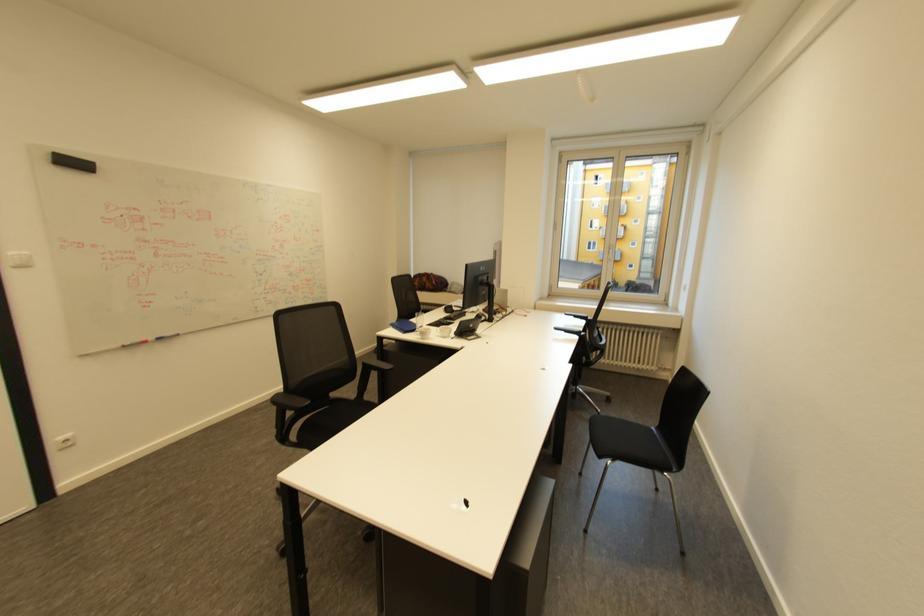
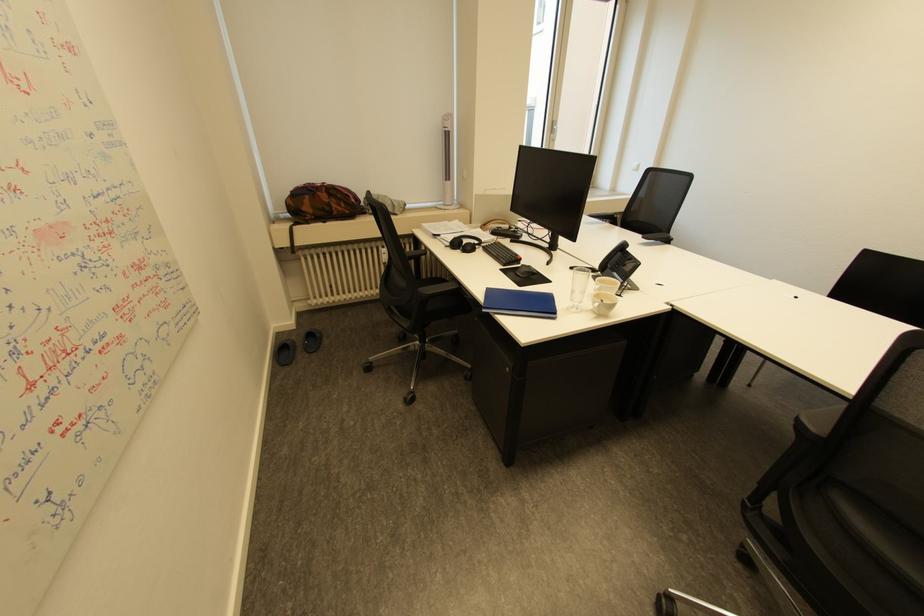
Where in the second image is the point corresponding to point (455, 284) from the first image?

(367, 200)